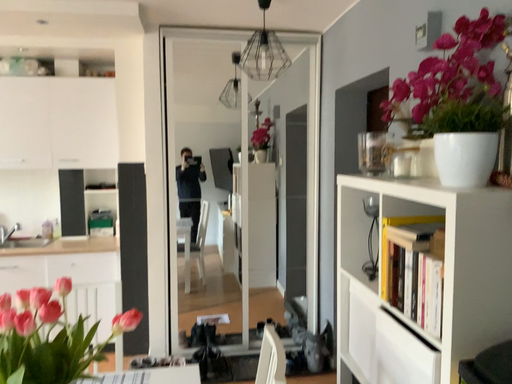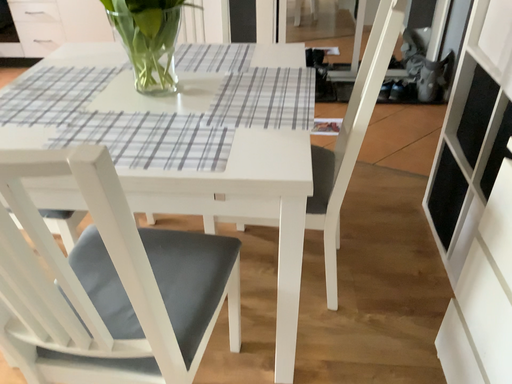
Question: Which way did the camera rotate in the video?

Choices:
 (A) rotated left
 (B) rotated right

Answer: (A)